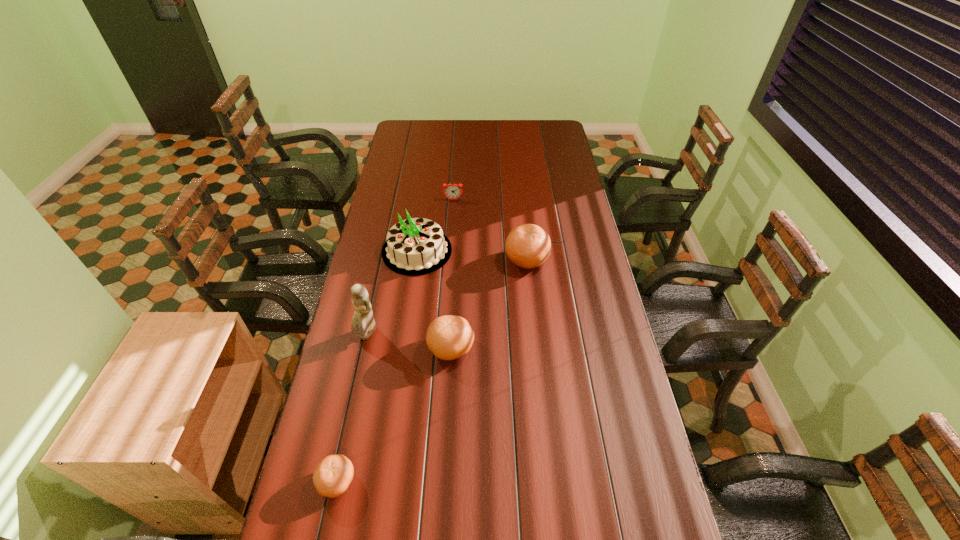
This screenshot has width=960, height=540. In the image, there is a desktop. Find the location of `vacant space at the far edge`. vacant space at the far edge is located at coordinates (452, 123).

Locate an element on the screen. This screenshot has width=960, height=540. vacant space at the left edge of the desktop is located at coordinates (368, 272).

Identify the location of free region at the right edge of the desktop. This screenshot has width=960, height=540. (567, 327).

Where is `free space at the far left corner of the desktop`? free space at the far left corner of the desktop is located at coordinates (414, 139).

Where is `vacant space at the near right corner of the desktop`? vacant space at the near right corner of the desktop is located at coordinates (608, 498).

Find the location of a particular element. The height and width of the screenshot is (540, 960). free space that is in between the fourth tallest object and the farthest object is located at coordinates (452, 274).

At what (x,y) coordinates should I click in order to perform the action: click on free space between the second tallest object and the second tallest clementine. Please return your answer as a coordinate pair (x, y). Looking at the image, I should click on (434, 300).

Locate an element on the screen. The width and height of the screenshot is (960, 540). free area in between the figurine and the nearest object is located at coordinates (352, 408).

Locate an element on the screen. The image size is (960, 540). vacant area between the alarm clock and the rightmost object is located at coordinates (490, 230).

I want to click on empty space between the leftmost clementine and the tallest object, so click(x=352, y=408).